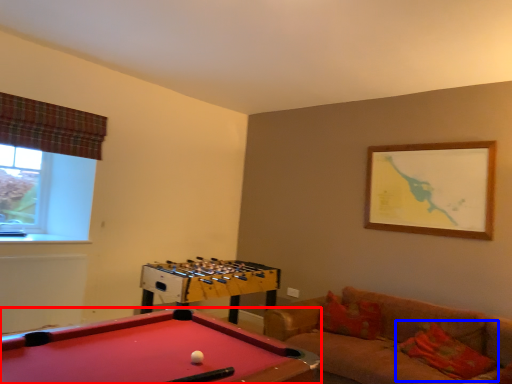
Question: Among these objects, which one is farthest to the camera, billiard table (highlighted by a red box) or pillow (highlighted by a blue box)?

Choices:
 (A) billiard table
 (B) pillow

Answer: (B)